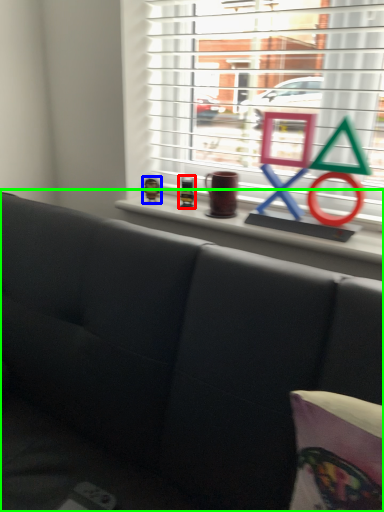
Question: Which is farther away from toy (highlighted by a red box)? toy (highlighted by a blue box) or studio couch (highlighted by a green box)?

Choices:
 (A) toy
 (B) studio couch

Answer: (B)